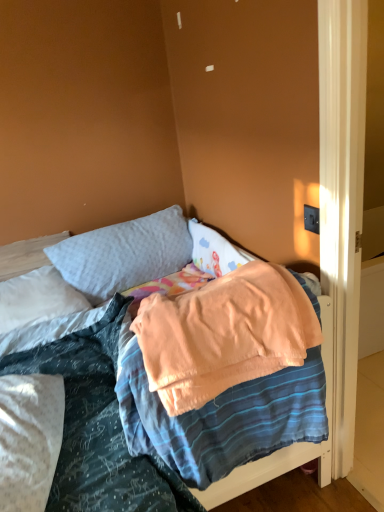
Question: Can you confirm if white soft pillow at upper left, which appears as the second pillow when viewed from the right, is taller than soft peach blanket at center?

Choices:
 (A) yes
 (B) no

Answer: (B)

Question: Can you confirm if white soft pillow at upper left, which appears as the first pillow when viewed from the left, is positioned to the right of soft peach blanket at center?

Choices:
 (A) yes
 (B) no

Answer: (B)

Question: Considering the relative sizes of white soft pillow at upper left, which appears as the second pillow when viewed from the right, and soft peach blanket at center in the image provided, is white soft pillow at upper left, which appears as the second pillow when viewed from the right, shorter than soft peach blanket at center?

Choices:
 (A) yes
 (B) no

Answer: (A)

Question: Is white soft pillow at upper left, which appears as the first pillow when viewed from the left, not inside soft peach blanket at center?

Choices:
 (A) yes
 (B) no

Answer: (A)

Question: Is white soft pillow at upper left, which appears as the first pillow when viewed from the left, closer to camera compared to soft peach blanket at center?

Choices:
 (A) yes
 (B) no

Answer: (B)

Question: Is soft peach blanket at center taller or shorter than white soft pillow at upper left, which appears as the second pillow when viewed from the right?

Choices:
 (A) tall
 (B) short

Answer: (A)

Question: In terms of width, does soft peach blanket at center look wider or thinner when compared to white soft pillow at upper left, which appears as the second pillow when viewed from the right?

Choices:
 (A) wide
 (B) thin

Answer: (A)

Question: From a real-world perspective, is soft peach blanket at center positioned above or below white soft pillow at upper left, which appears as the second pillow when viewed from the right?

Choices:
 (A) above
 (B) below

Answer: (A)

Question: Relative to white soft pillow at upper left, which appears as the first pillow when viewed from the left, is soft peach blanket at center in front or behind?

Choices:
 (A) behind
 (B) front

Answer: (B)

Question: Is soft peach blanket at center bigger or smaller than soft gray pillow at upper center, the 1th pillow viewed from the right?

Choices:
 (A) big
 (B) small

Answer: (A)

Question: Is point (134, 444) positioned closer to the camera than point (51, 262)?

Choices:
 (A) farther
 (B) closer

Answer: (B)

Question: Relative to soft gray pillow at upper center, which is the second pillow from left to right, is soft peach blanket at center in front or behind?

Choices:
 (A) behind
 (B) front

Answer: (B)

Question: Is soft peach blanket at center inside or outside of soft gray pillow at upper center, the 1th pillow viewed from the right?

Choices:
 (A) inside
 (B) outside

Answer: (B)

Question: Is soft gray pillow at upper center, which is the second pillow from left to right, wider or thinner than soft peach blanket at center?

Choices:
 (A) thin
 (B) wide

Answer: (A)

Question: Is point (125, 285) closer or farther from the camera than point (135, 357)?

Choices:
 (A) closer
 (B) farther

Answer: (B)